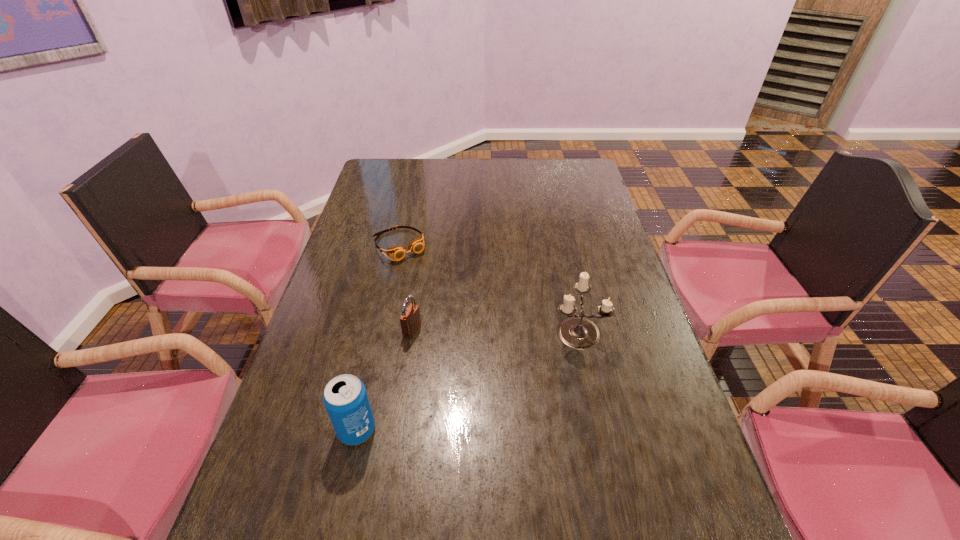
Where is `free space between the shortest object and the nearest object`? This screenshot has width=960, height=540. free space between the shortest object and the nearest object is located at coordinates (377, 338).

This screenshot has width=960, height=540. I want to click on free area in between the rightmost object and the nearest object, so click(468, 380).

Image resolution: width=960 pixels, height=540 pixels. I want to click on empty location between the soda can and the candle holder, so click(x=468, y=380).

Where is `free area in between the third tallest object and the goggles`? free area in between the third tallest object and the goggles is located at coordinates (405, 288).

Locate an element on the screen. vacant space that is in between the shortest object and the nearest object is located at coordinates (377, 338).

Find the location of a particular element. free area in between the padlock and the nearest object is located at coordinates (384, 380).

The height and width of the screenshot is (540, 960). Find the location of `free spot between the soda can and the shortest object`. free spot between the soda can and the shortest object is located at coordinates (377, 338).

Where is `vacant space that's between the padlock and the nearest object`? This screenshot has width=960, height=540. vacant space that's between the padlock and the nearest object is located at coordinates (384, 380).

What are the coordinates of `vacant space in between the goggles and the rightmost object` in the screenshot? It's located at (488, 288).

Identify the location of vacant region between the third tallest object and the farthest object. (405, 288).